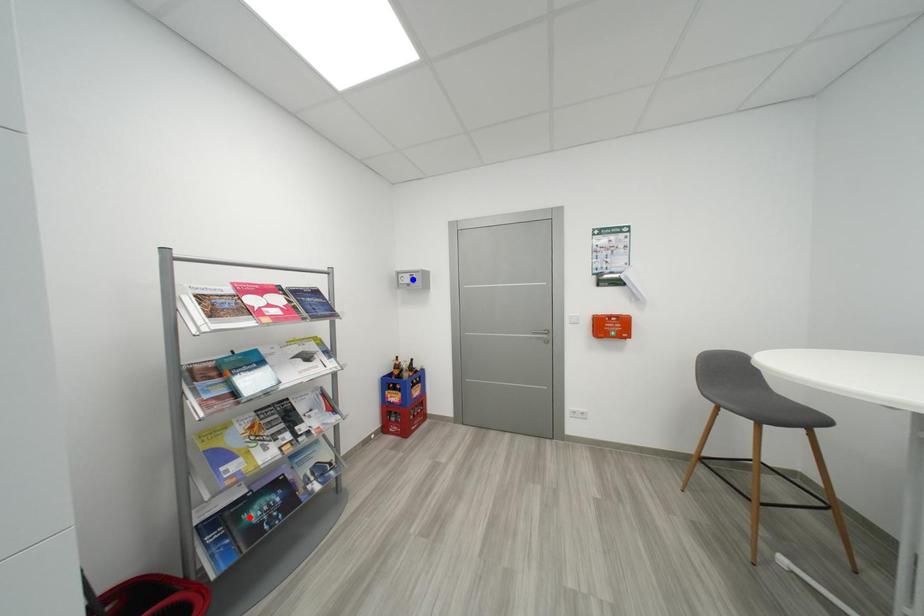
Question: In the image, two points are highlighted. Which point is nearer to the camera? Reply with the corresponding letter.

Choices:
 (A) blue point
 (B) red point

Answer: (B)